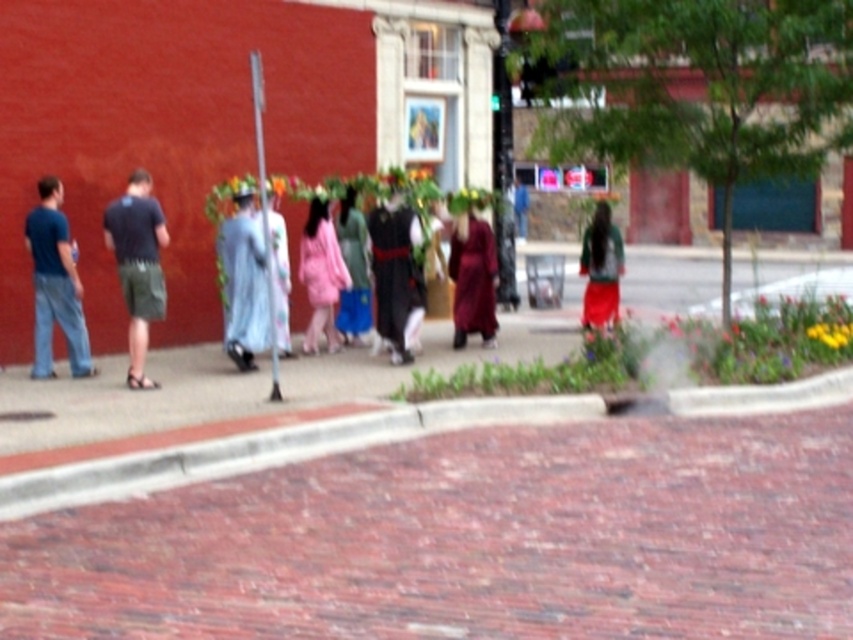
Question: Which object is closer to the camera taking this photo?

Choices:
 (A) brick pavement at center
 (B) dark blue t-shirt at left
 (C) blue denim jeans at left
 (D) pink satin dress at center

Answer: (A)

Question: Among these points, which one is farthest from the camera?

Choices:
 (A) (611, 240)
 (B) (366, 412)

Answer: (A)

Question: Which object appears closest to the camera in this image?

Choices:
 (A) maroon velvet robe at center
 (B) light blue fabric dress at center

Answer: (B)

Question: Does blue denim jeans at left lie behind light blue fabric dress at center?

Choices:
 (A) yes
 (B) no

Answer: (B)

Question: Is black velvet robe at center positioned before matte blue dress at center?

Choices:
 (A) yes
 (B) no

Answer: (A)

Question: Does brick pavement at center have a larger size compared to light blue fabric dress at center?

Choices:
 (A) yes
 (B) no

Answer: (B)